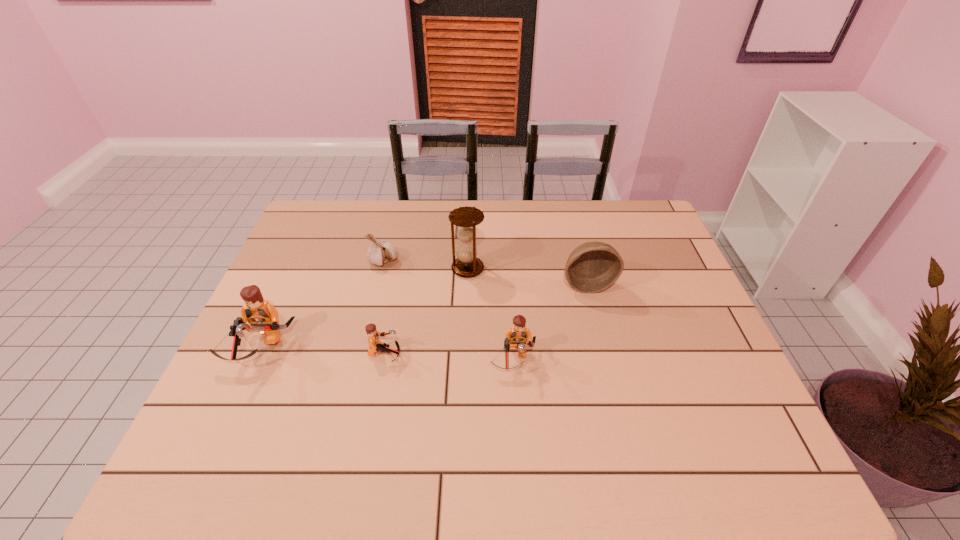
Find the location of a particular element. the tallest Lego is located at coordinates (263, 317).

Find the location of `the leftmost Lego`. the leftmost Lego is located at coordinates (263, 317).

This screenshot has width=960, height=540. Identify the location of the second Lego from left to right. 375,345.

What are the coordinates of `the second tallest Lego` in the screenshot? It's located at (518, 334).

At what (x,y) coordinates should I click in order to perform the action: click on the rightmost Lego. Please return your answer as a coordinate pair (x, y). The height and width of the screenshot is (540, 960). Looking at the image, I should click on (518, 334).

In order to click on bowl in this screenshot , I will do pyautogui.click(x=592, y=267).

Locate an element on the screen. garlic is located at coordinates (380, 252).

The image size is (960, 540). What are the coordinates of `hourglass` in the screenshot? It's located at (467, 264).

This screenshot has height=540, width=960. Identify the location of vacant space located holding a crossbow in the hands of the leftmost Lego. (239, 395).

Identify the location of vacant space located 0.370m holding a crossbow in the hands of the shortest Lego. (549, 355).